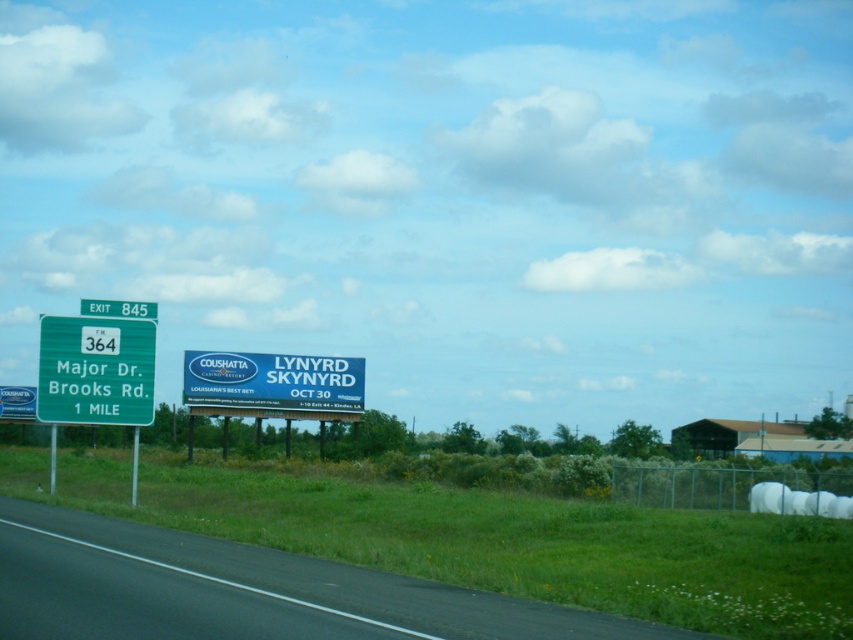
You are a driver approaching the green highway sign and the Lynyrd Skynyrd billboard. Based on the scene, where is the black asphalt road at lower left located in relation to the green highway sign and the billboard?

The black asphalt road at lower left is located at point coordinates of (242, 592), which is near the lower left corner of the scene. This places it below and to the left of both the green highway sign and the Lynyrd Skynyrd billboard, which are positioned more towards the center and right side of the image respectively.

You are standing at the edge of the highway and want to take a photo of both the green highway sign and the Lynyrd Skynyrd billboard. Which point, point 1 at coordinates (117, 556) or point 2 at coordinates (99, 410), should you focus on to ensure both objects are in clear focus?

You should focus on point 1 at coordinates (117, 556) because it is closer to the camera than point 2 at coordinates (99, 410), ensuring both the green highway sign and the Lynyrd Skynyrd billboard are in clear focus.

You are driving a car and see the black asphalt road at lower left and the green metallic sign at upper left. Which object is closer to you as you drive forward?

The black asphalt road at lower left is closer to you because it is in front of the green metallic sign at upper left.